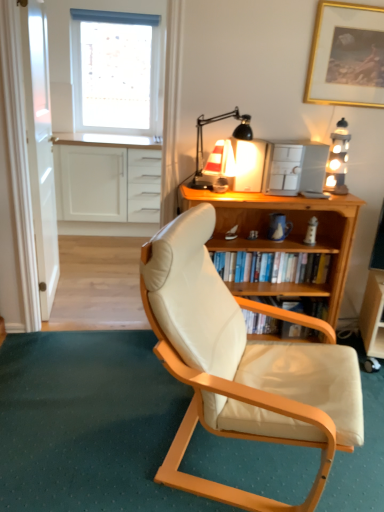
Identify the location of free region under transparent glass door at left (from a real-world perspective). (62, 292).